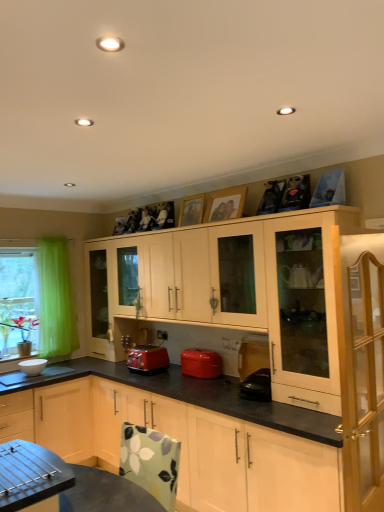
Question: Is light wood cabinet at right, which appears as the third cabinetry when viewed from the back, oriented towards light wood cabinet at upper right, the 1th cabinetry in the back-to-front sequence?

Choices:
 (A) yes
 (B) no

Answer: (B)

Question: Considering the relative positions of light wood cabinet at right, which appears as the third cabinetry when viewed from the back, and light wood cabinet at upper right, placed as the third cabinetry when sorted from front to back, in the image provided, is light wood cabinet at right, which appears as the third cabinetry when viewed from the back, behind light wood cabinet at upper right, placed as the third cabinetry when sorted from front to back,?

Choices:
 (A) no
 (B) yes

Answer: (A)

Question: From the image's perspective, is light wood cabinet at right, which appears as the third cabinetry when viewed from the back, above light wood cabinet at upper right, placed as the third cabinetry when sorted from front to back?

Choices:
 (A) no
 (B) yes

Answer: (A)

Question: Can you confirm if light wood cabinet at right, which appears as the third cabinetry when viewed from the back, is taller than light wood cabinet at upper right, placed as the third cabinetry when sorted from front to back?

Choices:
 (A) no
 (B) yes

Answer: (B)

Question: Is light wood cabinet at right, positioned as the 1th cabinetry in front-to-back order, positioned before light wood cabinet at upper right, placed as the third cabinetry when sorted from front to back?

Choices:
 (A) no
 (B) yes

Answer: (B)

Question: Is white glossy bowl at lower left, marked as the second appliance in a right-to-left arrangement, spatially inside floral fabric table at lower left, or outside of it?

Choices:
 (A) outside
 (B) inside

Answer: (A)

Question: In terms of width, does white glossy bowl at lower left, the second appliance from the front, look wider or thinner when compared to floral fabric table at lower left?

Choices:
 (A) thin
 (B) wide

Answer: (A)

Question: Relative to floral fabric table at lower left, is white glossy bowl at lower left, marked as the second appliance in a right-to-left arrangement, in front or behind?

Choices:
 (A) front
 (B) behind

Answer: (B)

Question: From the image's perspective, is white glossy bowl at lower left, the first appliance viewed from the back, above or below floral fabric table at lower left?

Choices:
 (A) above
 (B) below

Answer: (A)

Question: Is point (14, 385) closer or farther from the camera than point (162, 355)?

Choices:
 (A) farther
 (B) closer

Answer: (B)

Question: Is white glossy bowl at lower left spatially inside matte red toaster at center, the first kitchen appliance from the left, or outside of it?

Choices:
 (A) inside
 (B) outside

Answer: (B)

Question: In terms of size, does white glossy bowl at lower left appear bigger or smaller than matte red toaster at center, the first kitchen appliance from the left?

Choices:
 (A) big
 (B) small

Answer: (B)

Question: From their relative heights in the image, would you say white glossy bowl at lower left is taller or shorter than matte red toaster at center, the first kitchen appliance from the left?

Choices:
 (A) tall
 (B) short

Answer: (B)

Question: In terms of height, does white glossy bowl at lower left, marked as the second appliance in a right-to-left arrangement, look taller or shorter compared to light wood cabinet at upper right, placed as the third cabinetry when sorted from front to back?

Choices:
 (A) short
 (B) tall

Answer: (A)

Question: Considering the positions of white glossy bowl at lower left, the second appliance from the front, and light wood cabinet at upper right, placed as the third cabinetry when sorted from front to back, in the image, is white glossy bowl at lower left, the second appliance from the front, wider or thinner than light wood cabinet at upper right, placed as the third cabinetry when sorted from front to back,?

Choices:
 (A) wide
 (B) thin

Answer: (B)